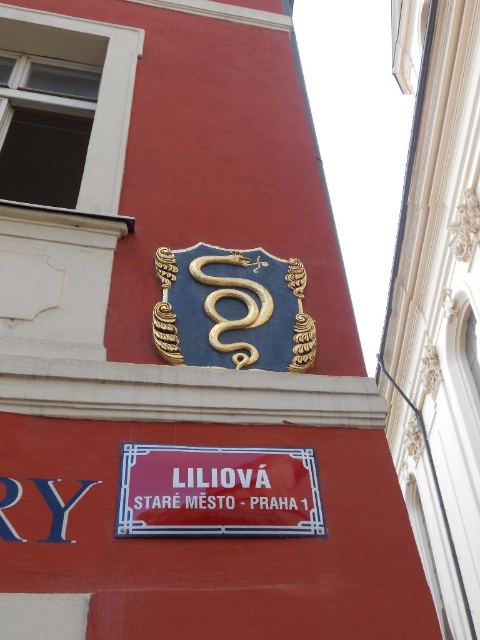
Question: Which point is farther to the camera?

Choices:
 (A) (249, 282)
 (B) (312, 474)

Answer: (A)

Question: Is gold metallic snake at center smaller than gold textured snake at upper center?

Choices:
 (A) no
 (B) yes

Answer: (B)

Question: In this image, where is gold metallic snake at center located relative to gold textured snake at upper center?

Choices:
 (A) left
 (B) right

Answer: (A)

Question: Does gold metallic snake at center lie behind gold textured snake at upper center?

Choices:
 (A) no
 (B) yes

Answer: (A)

Question: Among these points, which one is farthest from the camera?

Choices:
 (A) (271, 305)
 (B) (300, 513)

Answer: (A)